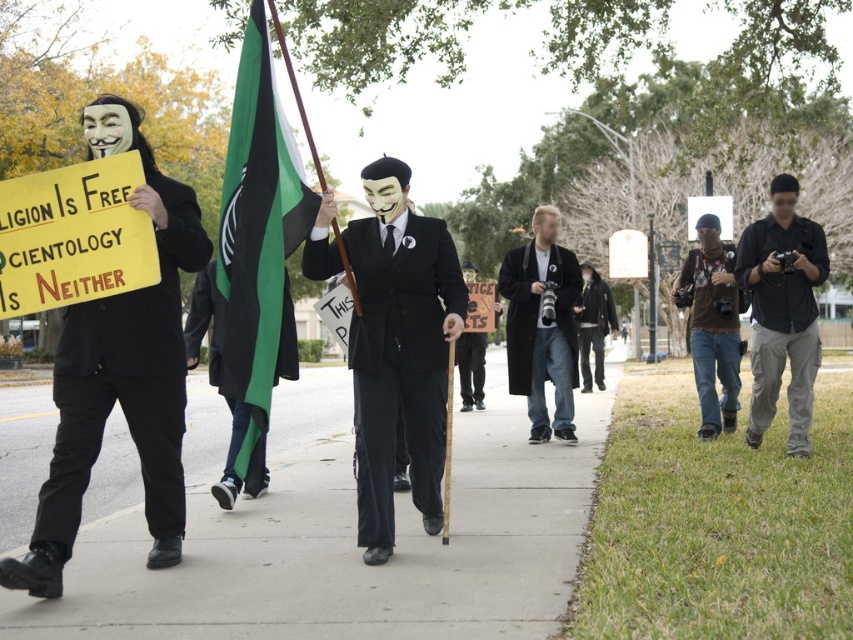
Question: Which point appears farthest from the camera in this image?

Choices:
 (A) (535, 246)
 (B) (798, 227)
 (C) (189, 561)

Answer: (A)

Question: Does green fabric flag at center lie in front of black wool coat at center?

Choices:
 (A) no
 (B) yes

Answer: (B)

Question: Is smooth concrete sidewalk at center positioned behind brown cotton shirt at center-right?

Choices:
 (A) no
 (B) yes

Answer: (A)

Question: From the image, what is the correct spatial relationship of matte black suit at center in relation to black wool coat at center?

Choices:
 (A) below
 (B) above

Answer: (A)

Question: Which point appears closest to the camera in this image?

Choices:
 (A) (756, 256)
 (B) (399, 195)

Answer: (B)

Question: Considering the real-world distances, which object is closest to the brown cotton shirt at center-right?

Choices:
 (A) black cotton shirt at right
 (B) smooth concrete sidewalk at center

Answer: (A)